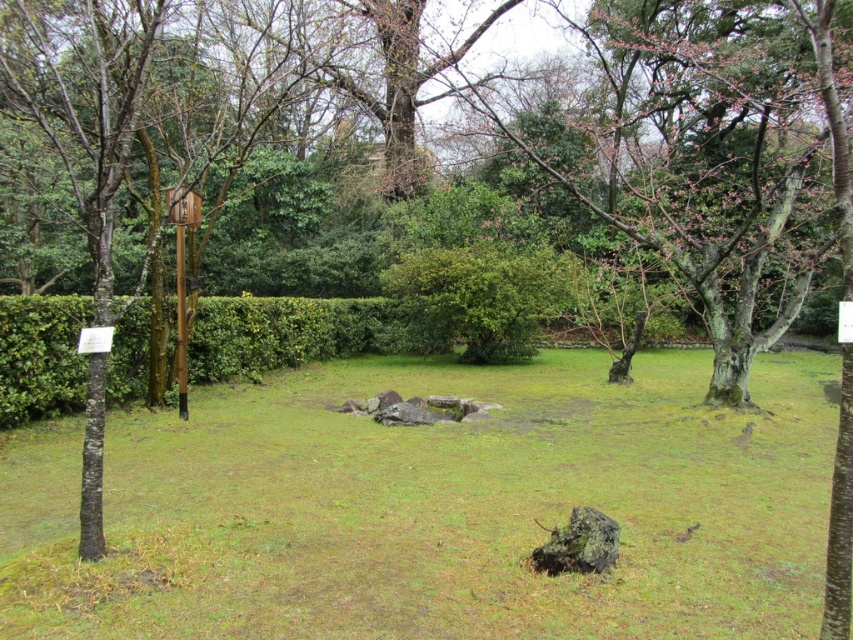
Question: Which point is closer to the camera taking this photo?

Choices:
 (A) (393, 536)
 (B) (15, 394)

Answer: (A)

Question: Which point is closer to the camera?

Choices:
 (A) green leafy hedge at center
 (B) green grass at center
 (C) green leafy bush at center

Answer: (B)

Question: Can you confirm if green leafy hedge at center is smaller than green leafy bush at center?

Choices:
 (A) yes
 (B) no

Answer: (B)

Question: Considering the relative positions of green leafy hedge at center and green leafy bush at center in the image provided, where is green leafy hedge at center located with respect to green leafy bush at center?

Choices:
 (A) right
 (B) left

Answer: (B)

Question: Which of these objects is positioned closest to the green leafy hedge at center?

Choices:
 (A) green leafy bush at center
 (B) green grass at center

Answer: (A)

Question: Is green grass at center positioned at the back of green leafy hedge at center?

Choices:
 (A) no
 (B) yes

Answer: (A)